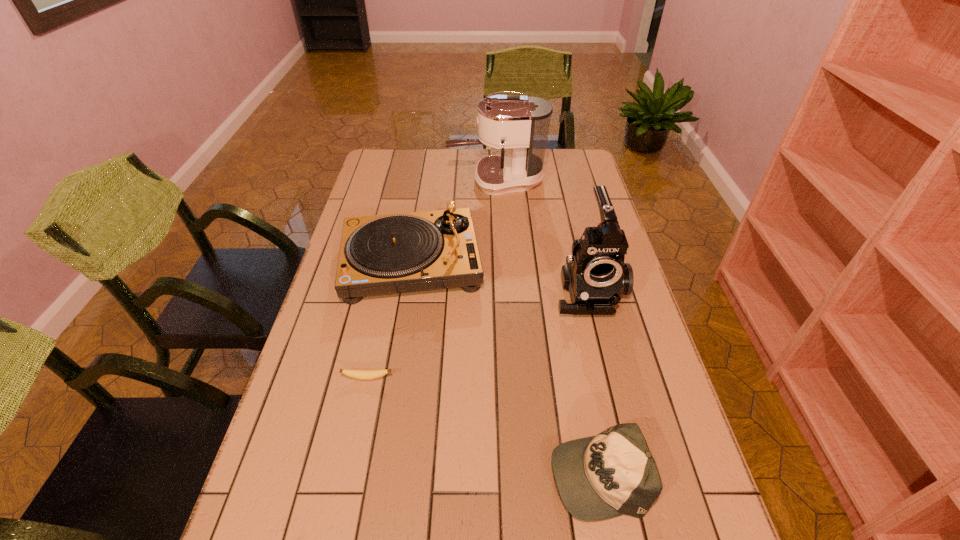
Locate an element on the screen. The width and height of the screenshot is (960, 540). vacant space positioned 0.060m on the lens mount of the second tallest object is located at coordinates (600, 338).

You are a GUI agent. You are given a task and a screenshot of the screen. Output one action in this format:
    pyautogui.click(x=<x>, y=<y>)
    Task: Click on the free space located on the back of the record player
    The width and height of the screenshot is (960, 540).
    Given the screenshot: What is the action you would take?
    pyautogui.click(x=426, y=175)

Where is `vacant space located on the front-facing side of the baseball cap`? vacant space located on the front-facing side of the baseball cap is located at coordinates (436, 474).

I want to click on vacant area situated on the front-facing side of the baseball cap, so click(441, 474).

You are a GUI agent. You are given a task and a screenshot of the screen. Output one action in this format:
    pyautogui.click(x=<x>, y=<y>)
    Task: Click on the vacant area located 0.360m on the front-facing side of the baseball cap
    The width and height of the screenshot is (960, 540).
    Given the screenshot: What is the action you would take?
    pyautogui.click(x=378, y=474)

Where is `free point located 0.060m on the left of the shortest object`? The height and width of the screenshot is (540, 960). free point located 0.060m on the left of the shortest object is located at coordinates (318, 378).

Locate an element on the screen. This screenshot has width=960, height=540. object that is at the far edge is located at coordinates (521, 123).

Locate an element on the screen. record player that is at the left edge is located at coordinates (393, 253).

This screenshot has width=960, height=540. Find the location of `banana located in the left edge section of the desktop`. banana located in the left edge section of the desktop is located at coordinates (353, 373).

Find the location of a particular element. This screenshot has height=540, width=960. camcorder that is positioned at the right edge is located at coordinates (595, 275).